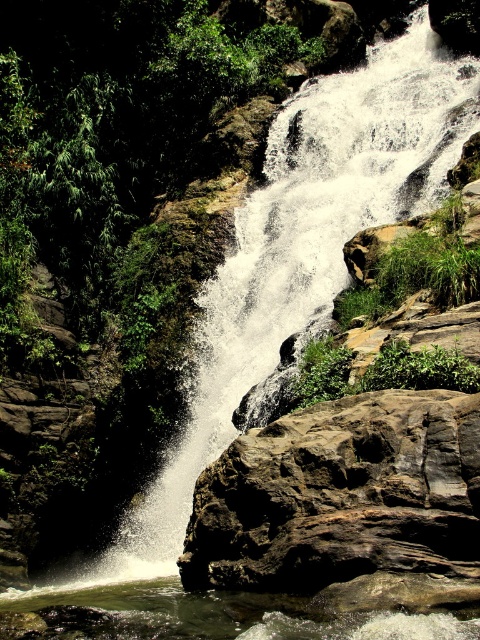
Can you confirm if brown rough rock at center is positioned below clear water at bottom center?

Incorrect, brown rough rock at center is not positioned below clear water at bottom center.

Does brown rough rock at center have a greater height compared to clear water at bottom center?

Indeed, brown rough rock at center has a greater height compared to clear water at bottom center.

At what (x,y) coordinates should I click in order to perform the action: click on brown rough rock at center. Please return your answer as a coordinate pair (x, y). Image resolution: width=480 pixels, height=640 pixels. Looking at the image, I should click on (340, 496).